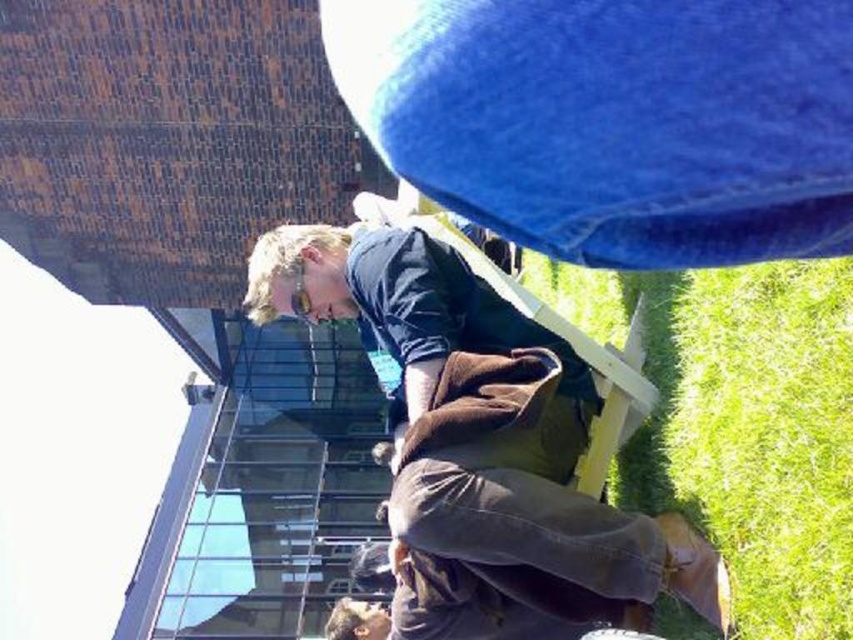
You are a photographer setting up a shot of the brown cotton squat at center and the green grass at lower right. Which object will appear larger in your photo?

The brown cotton squat at center will appear larger in the photo because it is bigger than the green grass at lower right.

You are a photographer setting up a shot of the brown cotton squat at center and the green grass at lower right. Which object should you focus on first to ensure both are in sharp focus?

You should focus on the brown cotton squat at center first because it is closer to the camera than the green grass at lower right, ensuring both will be in focus when using proper depth of field.